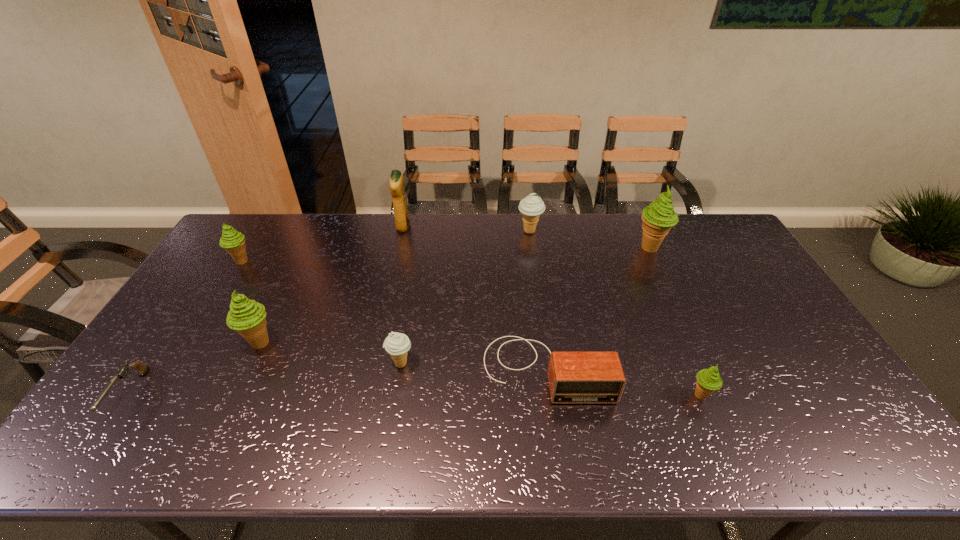
Where is `the tallest icecream`? The width and height of the screenshot is (960, 540). the tallest icecream is located at coordinates (659, 217).

The width and height of the screenshot is (960, 540). Find the location of `detergent`. detergent is located at coordinates (397, 188).

The height and width of the screenshot is (540, 960). What are the coordinates of `the second biggest green icecream` in the screenshot? It's located at (248, 317).

At what (x,y) coordinates should I click in order to perform the action: click on the second icecream from left to right. Please return your answer as a coordinate pair (x, y). The width and height of the screenshot is (960, 540). Looking at the image, I should click on (248, 317).

Identify the location of the farther beige icecream. This screenshot has height=540, width=960. (531, 207).

Image resolution: width=960 pixels, height=540 pixels. I want to click on the right beige icecream, so click(531, 207).

The height and width of the screenshot is (540, 960). Identify the location of the third biggest green icecream. (232, 241).

Identify the location of the second object from left to right. The height and width of the screenshot is (540, 960). (232, 241).

Find the location of a particular element. The height and width of the screenshot is (540, 960). the smaller beige icecream is located at coordinates (396, 344).

Find the location of `the nearer beige icecream`. the nearer beige icecream is located at coordinates (396, 344).